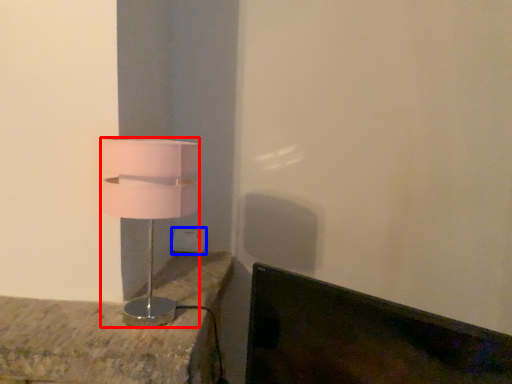
Question: Which object appears closest to the camera in this image, lamp (highlighted by a red box) or electric outlet (highlighted by a blue box)?

Choices:
 (A) lamp
 (B) electric outlet

Answer: (A)